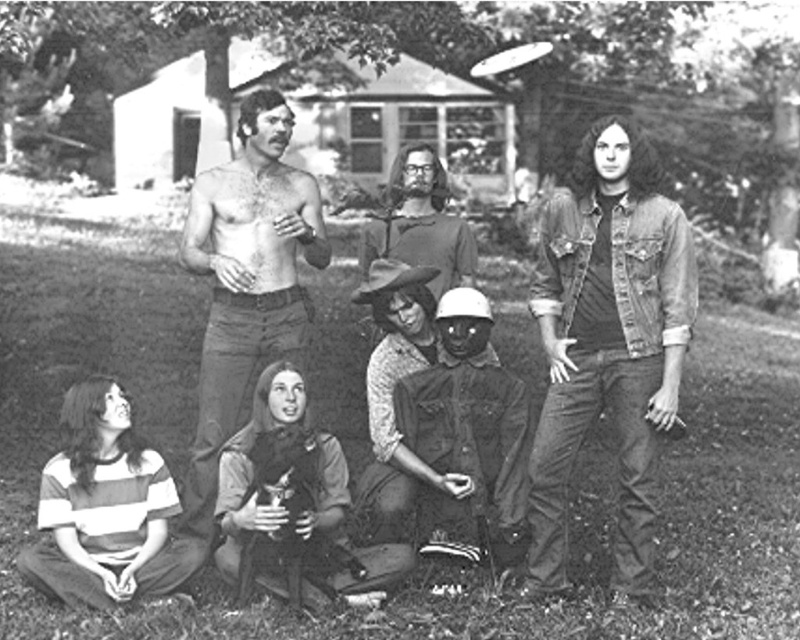
You are trying to decide which piece of clothing to take for a costume party. You see the denim shirt at center and the denim jacket at center in the photo. Which one has a wider width?

The denim shirt at center might be wider than denim jacket at center.

You are a photographer who wants to focus on the shiny skin torso at center and the denim jacket at center in the photo. Which one is positioned closer to the camera?

The shiny skin torso at center is closer to the viewer than the denim jacket at center, so it is positioned closer to the camera.